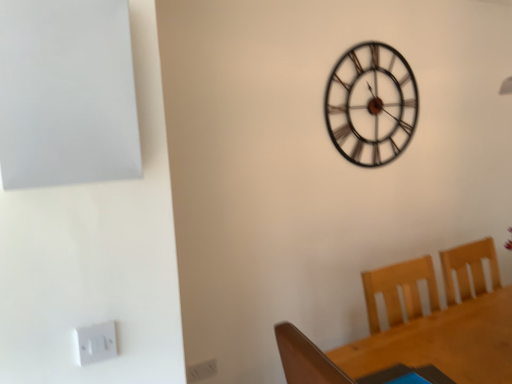
Identify the location of free space above metallic black clock at upper center (from a real-world perspective). The image size is (512, 384). (377, 46).